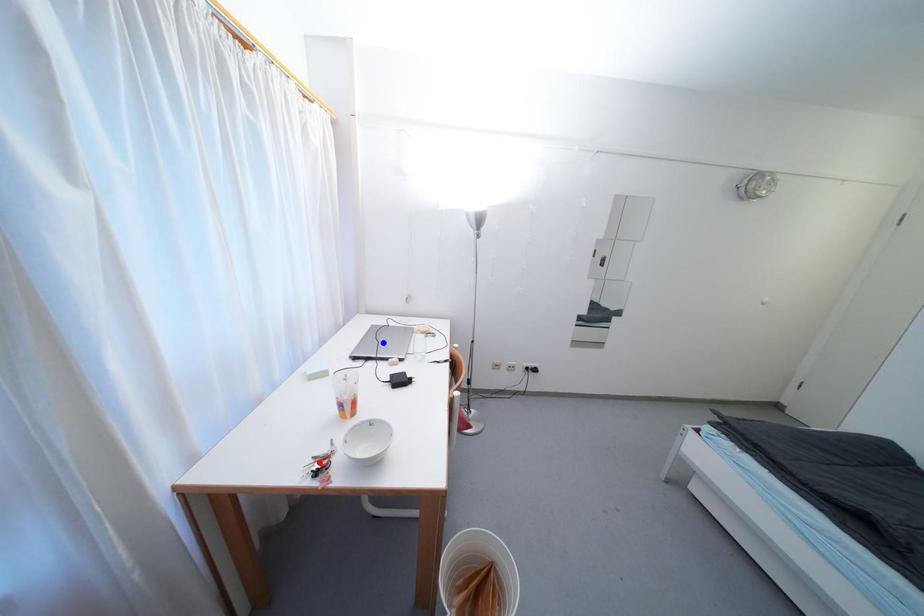
Question: In the image, two points are highlighted. Which point is nearer to the camera? Reply with the corresponding letter.

Choices:
 (A) blue point
 (B) red point

Answer: (B)